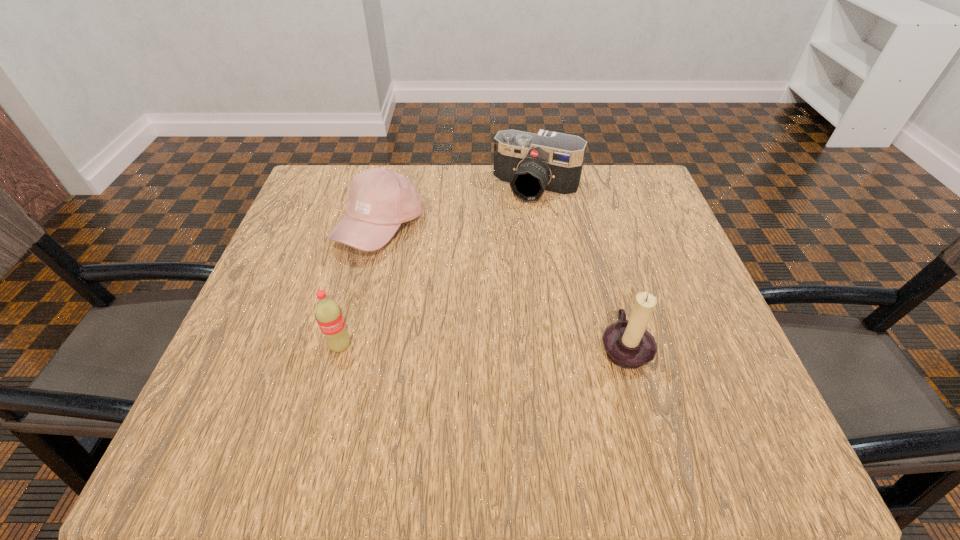
Identify the location of vacant region located 0.250m on the front-facing side of the camera. This screenshot has width=960, height=540. (488, 274).

Find the location of a particular element. Image resolution: width=960 pixels, height=540 pixels. vacant space located 0.260m on the front-facing side of the camera is located at coordinates (487, 277).

Identify the location of baseball cap that is at the far edge. (380, 199).

Locate an element on the screen. The image size is (960, 540). camera that is positioned at the far edge is located at coordinates (549, 162).

The width and height of the screenshot is (960, 540). Identify the location of object that is at the near edge. (628, 344).

You are a GUI agent. You are given a task and a screenshot of the screen. Output one action in this format:
    pyautogui.click(x=<x>, y=<y>)
    Task: Click on the object at the left edge
    This screenshot has height=540, width=960.
    Given the screenshot: What is the action you would take?
    pyautogui.click(x=380, y=199)

Where is `object that is at the right edge`? This screenshot has height=540, width=960. object that is at the right edge is located at coordinates pos(628,344).

Locate an element on the screen. object present at the far left corner is located at coordinates (380, 199).

This screenshot has height=540, width=960. I want to click on object that is at the near right corner, so click(x=628, y=344).

In the image, there is a desktop. Find the location of `free space at the far edge`. free space at the far edge is located at coordinates (527, 218).